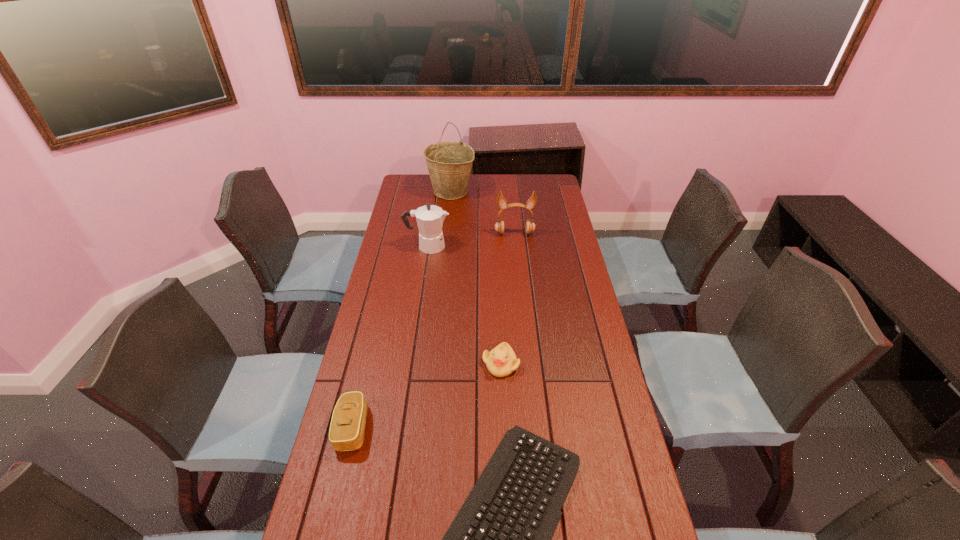
Where is `free space at the far right corner of the desktop`? Image resolution: width=960 pixels, height=540 pixels. free space at the far right corner of the desktop is located at coordinates (527, 176).

Image resolution: width=960 pixels, height=540 pixels. I want to click on free space between the earphone and the clutch bag, so click(434, 330).

At what (x,y) coordinates should I click in order to perform the action: click on vacant space in between the second farthest object and the duckling. Please return your answer as a coordinate pair (x, y). Image resolution: width=960 pixels, height=540 pixels. Looking at the image, I should click on click(x=508, y=299).

What are the coordinates of `free point between the second farthest object and the third nearest object` in the screenshot? It's located at (508, 299).

The image size is (960, 540). I want to click on vacant space in between the duckling and the clutch bag, so click(427, 396).

You are a GUI agent. You are given a task and a screenshot of the screen. Output one action in this format:
    pyautogui.click(x=<x>, y=<y>)
    Task: Click on the vacant space that is in between the earphone and the duckling
    The height and width of the screenshot is (540, 960).
    Given the screenshot: What is the action you would take?
    pyautogui.click(x=508, y=299)

The height and width of the screenshot is (540, 960). What are the coordinates of `free space between the tallest object and the fifth nearest object` in the screenshot? It's located at (483, 212).

Identify which object is the second nearest to the shortest object. Please provide its 2D coordinates. Your answer should be formatted as a tuple, i.e. [(x, y)], where the tuple contains the x and y coordinates of a point satisfying the conditions above.

[(347, 427)]

Locate which object ranks fourth in proximity to the fifth nearest object. Please provide its 2D coordinates. Your answer should be formatted as a tuple, i.e. [(x, y)], where the tuple contains the x and y coordinates of a point satisfying the conditions above.

[(500, 539)]

This screenshot has height=540, width=960. In order to click on vacant space that satisfies the following two spatial constraints: 1. at the face of the duckling; 2. on the zipper side of the clutch bag in this screenshot , I will do `click(504, 428)`.